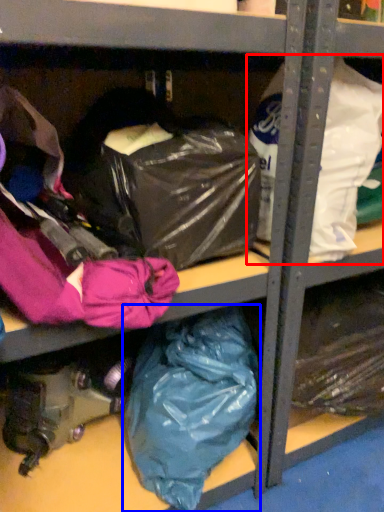
Question: Which object is closer to the camera taking this photo, plastic bag (highlighted by a red box) or plastic bag (highlighted by a blue box)?

Choices:
 (A) plastic bag
 (B) plastic bag

Answer: (A)